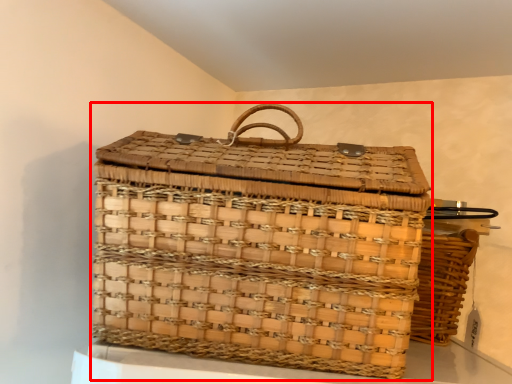
Question: From the image's perspective, considering the relative positions of picnic basket (annotated by the red box) and picnic basket in the image provided, where is picnic basket (annotated by the red box) located with respect to the staircase?

Choices:
 (A) below
 (B) above

Answer: (B)